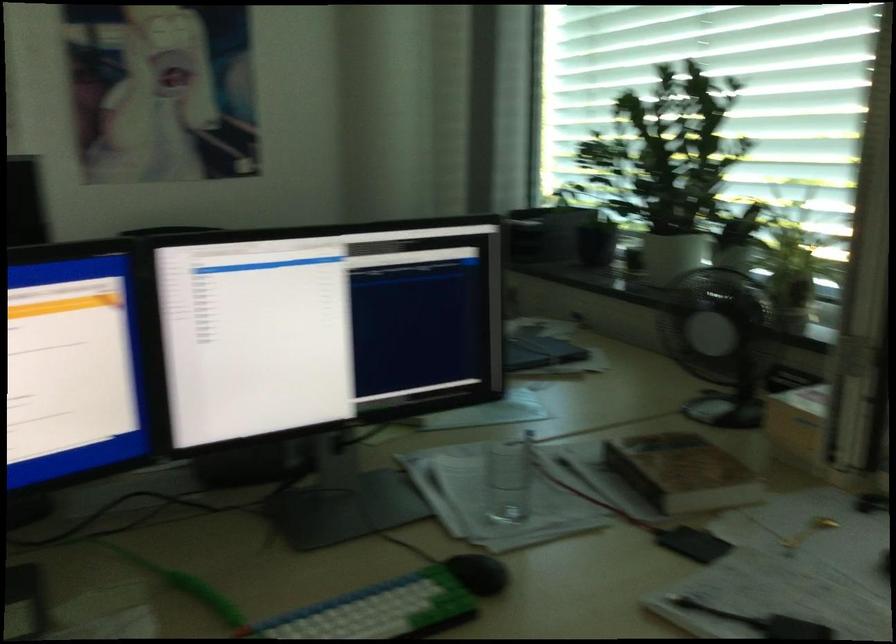
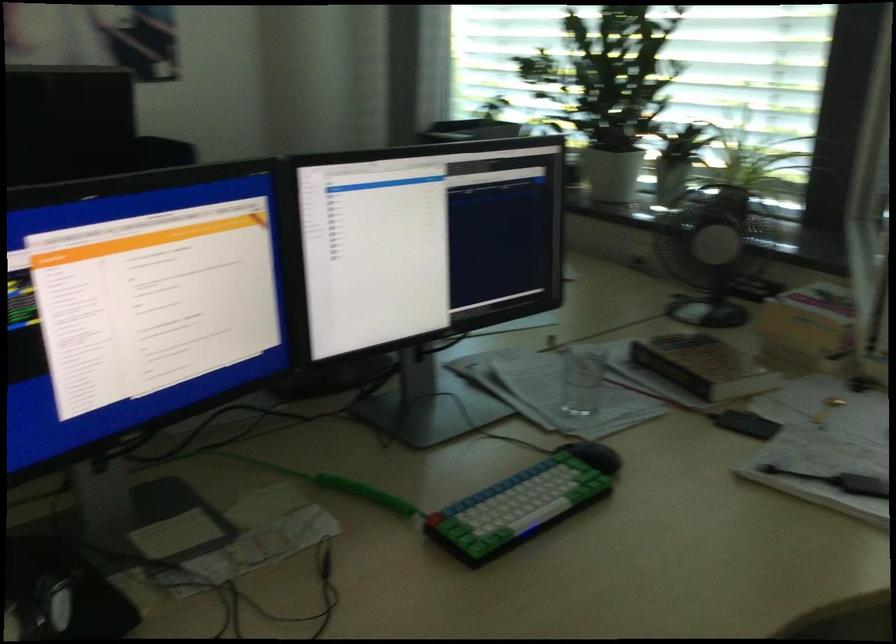
Locate, in the second image, the point that corresponds to point (807, 431) in the first image.

(810, 326)